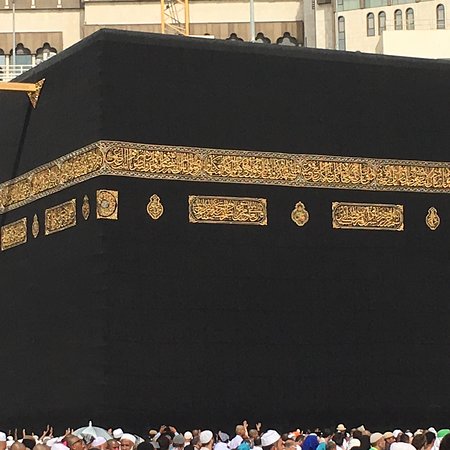
Locate an element on the screen. Image resolution: width=450 pixels, height=450 pixels. possible ladder is located at coordinates (187, 16).